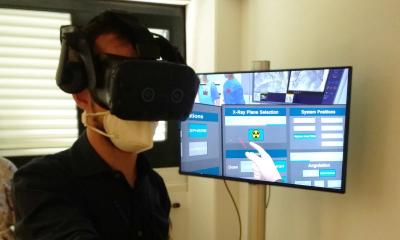
Identify the location of pole holding tv. The height and width of the screenshot is (240, 400). (257, 196).